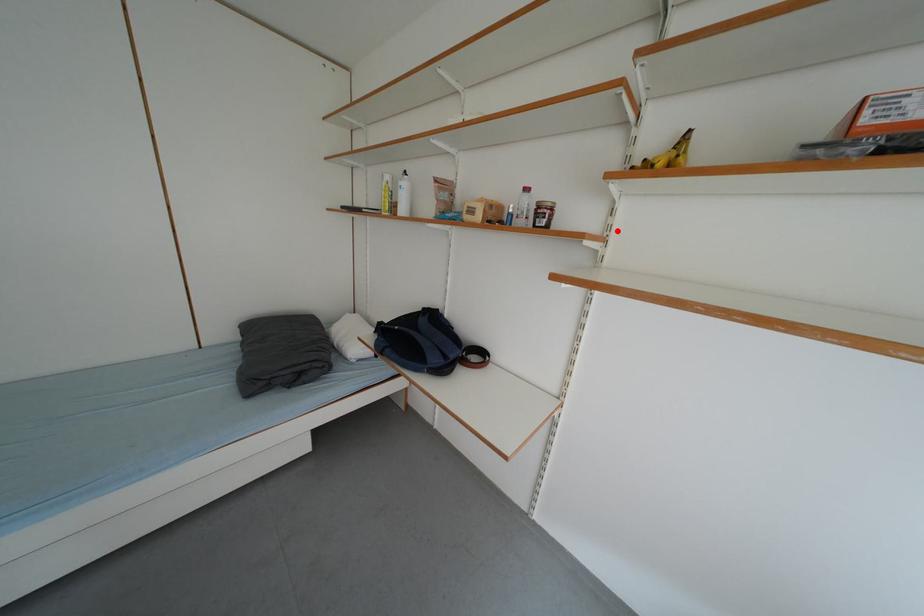
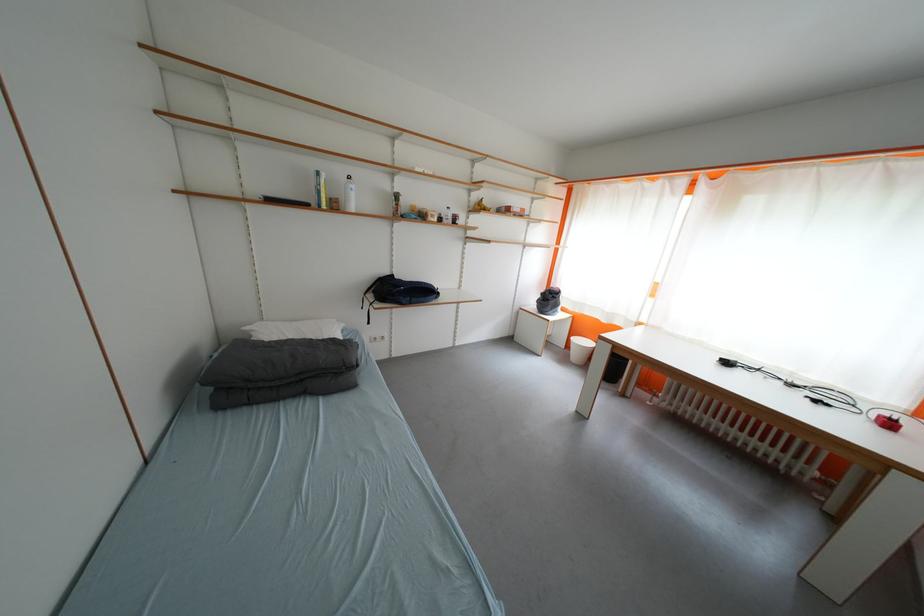
Locate, in the second image, the point that corresponds to the highlighted location in the first image.

(476, 225)